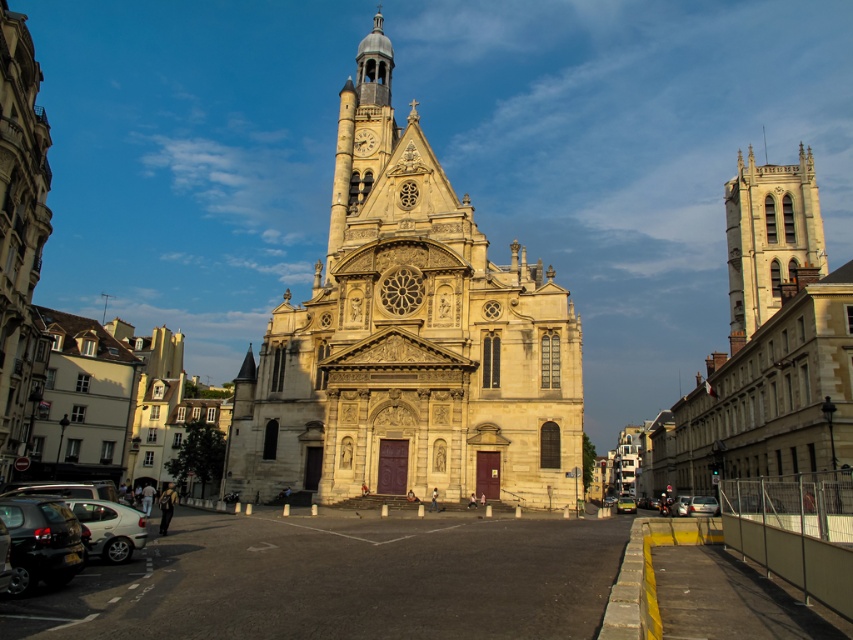
You are a pedestrian standing at the base of the church facing the entrance. You need to cross the street to reach the park on the other side. There are two metallic silver cars in view. The first is at the lower left, and the second is at the center. Given that the safe crossing distance for pedestrians is 60 meters, can you safely cross between the two metallic silver car at lower left and metallic silver car at center?

The metallic silver car at lower left and metallic silver car at center are 57.06 meters apart. Since the safe crossing distance is 60 meters, the gap between them is narrower than required. Therefore, it is not safe to cross between the two metallic silver car at lower left and metallic silver car at center.